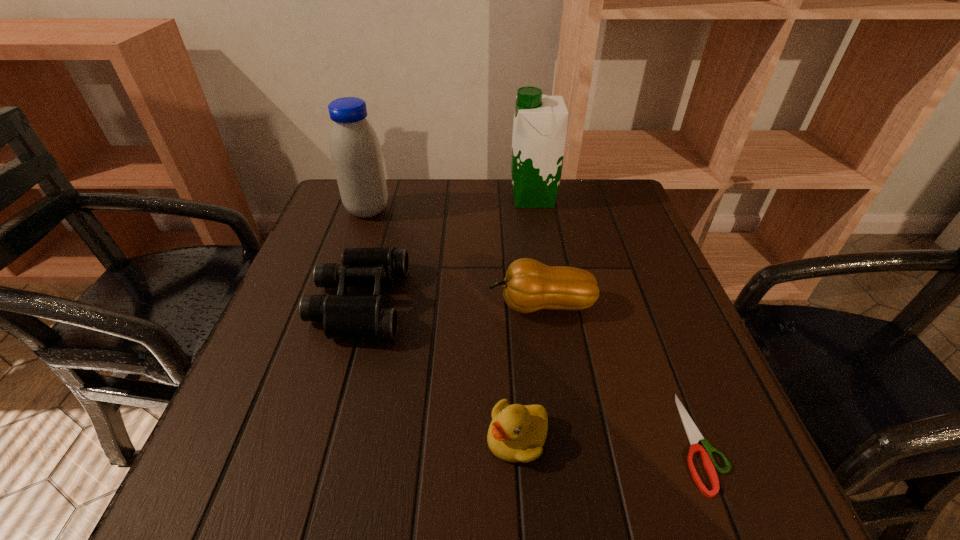
Locate an element on the screen. vacant area between the duckling and the right soya milk is located at coordinates (525, 318).

Locate an element on the screen. This screenshot has height=540, width=960. free space between the duckling and the binoculars is located at coordinates (438, 370).

Select which object appears as the third closest to the duckling. Please provide its 2D coordinates. Your answer should be formatted as a tuple, i.e. [(x, y)], where the tuple contains the x and y coordinates of a point satisfying the conditions above.

[(352, 317)]

I want to click on object that can be found as the fourth closest to the shortest object, so [x=540, y=123].

I want to click on free space that satisfies the following two spatial constraints: 1. on the back side of the shortest object; 2. on the stem side of the gourd, so click(x=646, y=305).

The image size is (960, 540). In order to click on vacant space that satisfies the following two spatial constraints: 1. on the front-facing side of the shortest object; 2. on the right side of the binoculars in this screenshot , I will do point(319,442).

This screenshot has width=960, height=540. Find the location of `free space that satisfies the following two spatial constraints: 1. on the front-facing side of the right soya milk; 2. on the right side of the shortest object`. free space that satisfies the following two spatial constraints: 1. on the front-facing side of the right soya milk; 2. on the right side of the shortest object is located at coordinates (574, 442).

You are a GUI agent. You are given a task and a screenshot of the screen. Output one action in this format:
    pyautogui.click(x=<x>, y=<y>)
    Task: Click on the vacant region that satisfies the following two spatial constraints: 1. on the back side of the shortest object; 2. on the beak of the second shortest object
    This screenshot has height=540, width=960.
    Given the screenshot: What is the action you would take?
    pyautogui.click(x=698, y=437)

Where is `vacant region that satisfies the following two spatial constraints: 1. on the front-facing side of the right soya milk; 2. on the right side of the shortest object`? vacant region that satisfies the following two spatial constraints: 1. on the front-facing side of the right soya milk; 2. on the right side of the shortest object is located at coordinates (574, 442).

Image resolution: width=960 pixels, height=540 pixels. What are the coordinates of `free space that satisfies the following two spatial constraints: 1. on the front-facing side of the right soya milk; 2. on the front side of the left soya milk` in the screenshot? It's located at (536, 210).